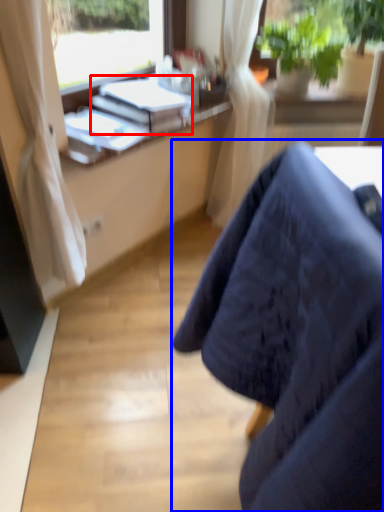
Question: Which of the following is the farthest to the observer, book (highlighted by a red box) or chair (highlighted by a blue box)?

Choices:
 (A) book
 (B) chair

Answer: (A)